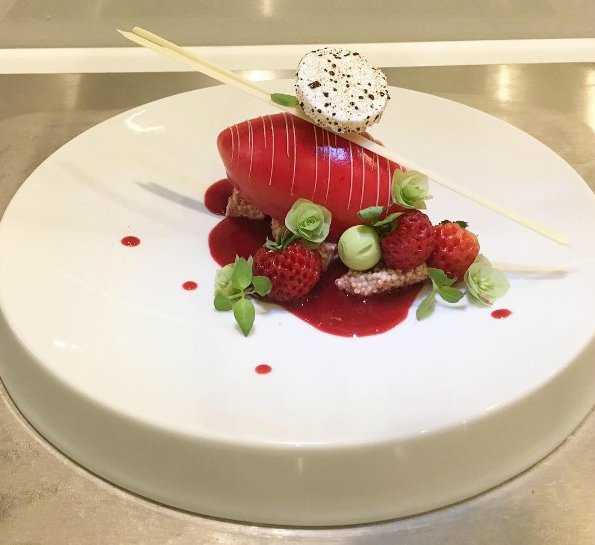
Where is `white plate`? white plate is located at coordinates (124, 209), (516, 211).